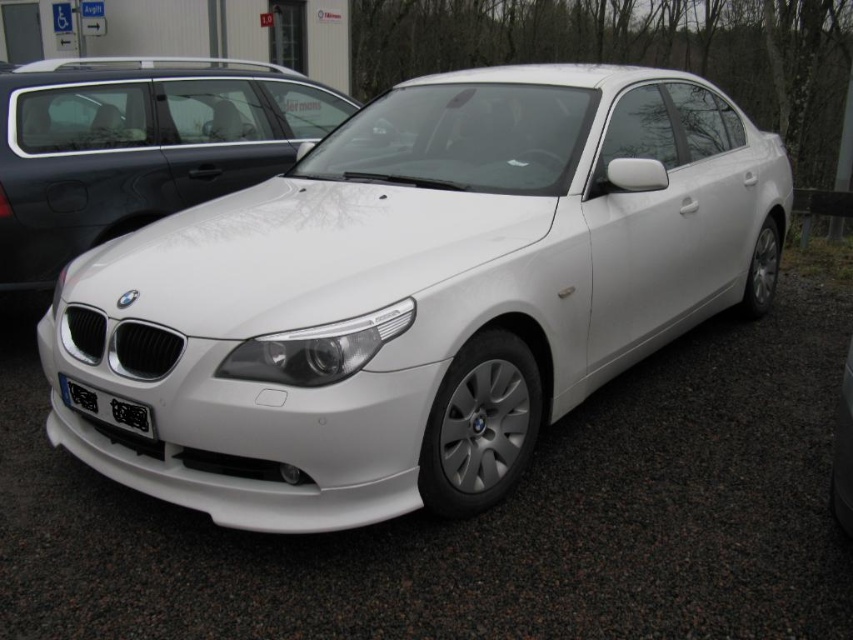
From the picture: You are a parking attendant who needs to ensure that the white glossy sedan at center and the black plastic license plate at front are aligned properly for a photo shoot. Which object should be positioned to the left to ensure proper alignment?

The white glossy sedan at center should be positioned to the left of the black plastic license plate at front since the sedan is wider and needs more space for alignment.

Please provide the exact coordinates of the white glossy sedan at center in the image.

The white glossy sedan at center is located at coordinates point [137,147].

You are a parking attendant who needs to fit both the white metallic car at center and the white glossy sedan at center into a parking spot that is 2.5 meters wide. Based on their widths, which car would require more space between them to park side by side?

The white metallic car at center is wider than the white glossy sedan at center, so it would require more space between them to park side by side.